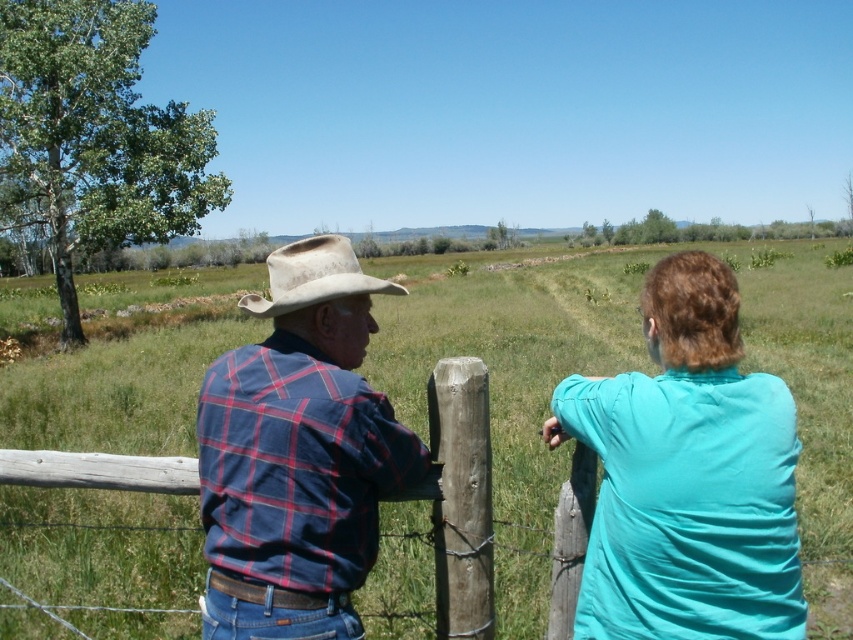
Question: Among these objects, which one is nearest to the camera?

Choices:
 (A) worn beige fabric cowboy hat at upper center
 (B) plaid fabric shirt at left
 (C) plaid cotton shirt at center

Answer: (C)

Question: Is plaid fabric shirt at left wider than plaid cotton shirt at center?

Choices:
 (A) yes
 (B) no

Answer: (A)

Question: Which of these objects is positioned closest to the plaid cotton shirt at center?

Choices:
 (A) plaid fabric shirt at left
 (B) worn beige fabric cowboy hat at upper center
 (C) teal fabric shirt at right

Answer: (A)

Question: Is plaid fabric shirt at left to the right of plaid cotton shirt at center from the viewer's perspective?

Choices:
 (A) yes
 (B) no

Answer: (A)

Question: Which of these objects is positioned farthest from the plaid cotton shirt at center?

Choices:
 (A) plaid fabric shirt at left
 (B) teal fabric shirt at right
 (C) worn beige fabric cowboy hat at upper center

Answer: (C)

Question: Is plaid fabric shirt at left positioned before plaid cotton shirt at center?

Choices:
 (A) no
 (B) yes

Answer: (A)